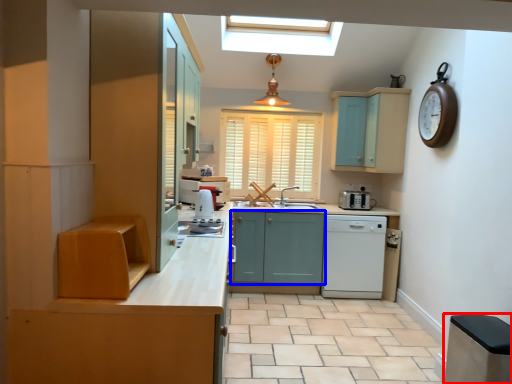
Question: Which object is further to the camera taking this photo, cabinetry (highlighted by a red box) or cabinetry (highlighted by a blue box)?

Choices:
 (A) cabinetry
 (B) cabinetry

Answer: (B)